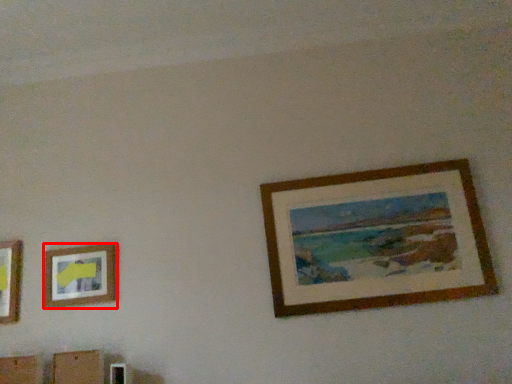
Question: From the image's perspective, what is the correct spatial relationship of picture frame (annotated by the red box) in relation to picture frame?

Choices:
 (A) below
 (B) above

Answer: (A)